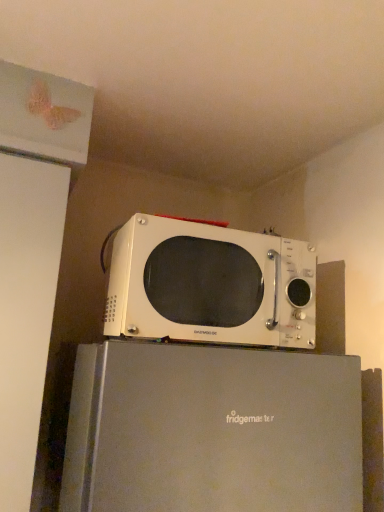
The width and height of the screenshot is (384, 512). Describe the element at coordinates (210, 285) in the screenshot. I see `white matte microwave at upper center` at that location.

I want to click on white matte microwave at upper center, so click(x=210, y=285).

Identify the location of white matte microwave at upper center. This screenshot has width=384, height=512. (210, 285).